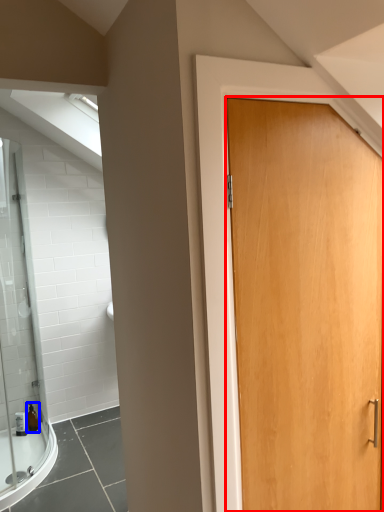
Question: Which point is further to the camera, door (highlighted by a red box) or toiletry (highlighted by a blue box)?

Choices:
 (A) door
 (B) toiletry

Answer: (B)